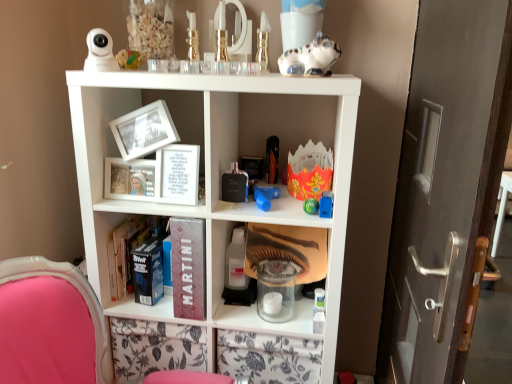
Question: From the image's perspective, would you say dark matte book at center, acting as the second book starting from the front, is shown under blue plastic toy at center, acting as the eighth toy starting from the top?

Choices:
 (A) yes
 (B) no

Answer: (A)

Question: Is dark matte book at center, which ranks as the 1th book in back-to-front order, wider than blue plastic toy at center, placed as the 2th toy when sorted from bottom to top?

Choices:
 (A) yes
 (B) no

Answer: (A)

Question: Is the position of dark matte book at center, positioned as the first book in bottom-to-top order, more distant than that of blue plastic toy at center, which is the ninth toy from left to right?

Choices:
 (A) yes
 (B) no

Answer: (A)

Question: From the image's perspective, is dark matte book at center, positioned as the first book in bottom-to-top order, located above blue plastic toy at center, placed as the 2th toy when sorted from bottom to top?

Choices:
 (A) yes
 (B) no

Answer: (B)

Question: Is dark matte book at center, positioned as the first book in bottom-to-top order, located outside blue plastic toy at center, which is the ninth toy from left to right?

Choices:
 (A) no
 (B) yes

Answer: (B)

Question: From the image's perspective, is dark matte book at center, which ranks as the 1th book in back-to-front order, positioned above or below transparent plastic bottle at center?

Choices:
 (A) below
 (B) above

Answer: (A)

Question: Is dark matte book at center, the 2th book viewed from the top, to the left or to the right of transparent plastic bottle at center in the image?

Choices:
 (A) right
 (B) left

Answer: (B)

Question: In terms of width, does dark matte book at center, acting as the second book starting from the front, look wider or thinner when compared to transparent plastic bottle at center?

Choices:
 (A) thin
 (B) wide

Answer: (B)

Question: Does point (177, 226) appear closer or farther from the camera than point (234, 281)?

Choices:
 (A) farther
 (B) closer

Answer: (B)

Question: Is transparent plastic candle at center wider or thinner than matte silver door handle at right?

Choices:
 (A) thin
 (B) wide

Answer: (A)

Question: Is transparent plastic candle at center in front of or behind matte silver door handle at right in the image?

Choices:
 (A) front
 (B) behind

Answer: (B)

Question: Considering the relative positions of transparent plastic candle at center and matte silver door handle at right in the image provided, is transparent plastic candle at center to the left or to the right of matte silver door handle at right?

Choices:
 (A) left
 (B) right

Answer: (A)

Question: Considering the positions of point (304, 317) and point (428, 178), is point (304, 317) closer or farther from the camera than point (428, 178)?

Choices:
 (A) closer
 (B) farther

Answer: (B)

Question: Is white paper frame at center, which is the 2th book in bottom-to-top order, wider or thinner than blue plastic toy at center, placed as the 2th toy when sorted from bottom to top?

Choices:
 (A) thin
 (B) wide

Answer: (B)

Question: Considering their positions, is white paper frame at center, arranged as the 1th book when viewed from the front, located in front of or behind blue plastic toy at center, acting as the eighth toy starting from the top?

Choices:
 (A) front
 (B) behind

Answer: (B)